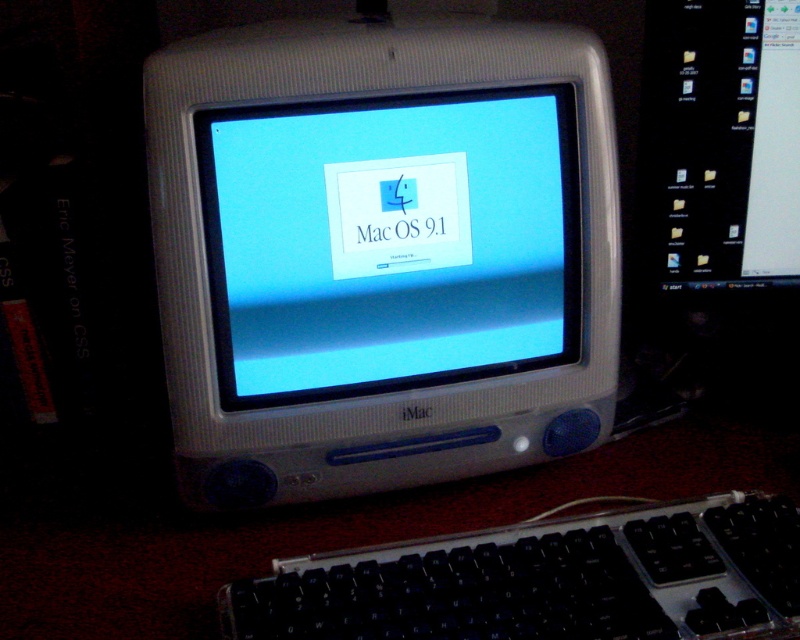
Is point (245, 96) closer to viewer compared to point (716, 424)?

Yes, point (245, 96) is closer to viewer.

Image resolution: width=800 pixels, height=640 pixels. What are the coordinates of `white plastic imac at center` in the screenshot? It's located at (381, 253).

Describe the element at coordinates (381, 253) in the screenshot. I see `white plastic imac at center` at that location.

The image size is (800, 640). What are the coordinates of `white plastic imac at center` in the screenshot? It's located at (381, 253).

Is satin silver imac at center to the right of black plastic keyboard at lower center from the viewer's perspective?

In fact, satin silver imac at center is to the left of black plastic keyboard at lower center.

Can you confirm if satin silver imac at center is positioned below black plastic keyboard at lower center?

No, satin silver imac at center is not below black plastic keyboard at lower center.

Identify the location of satin silver imac at center. (310, 524).

I want to click on satin silver imac at center, so click(x=310, y=524).

Who is shorter, white plastic imac at center or black plastic keyboard at lower center?

black plastic keyboard at lower center is shorter.

Does white plastic imac at center appear on the right side of black plastic keyboard at lower center?

Answer: Incorrect, white plastic imac at center is not on the right side of black plastic keyboard at lower center.

The image size is (800, 640). Find the location of `white plastic imac at center`. white plastic imac at center is located at coordinates (381, 253).